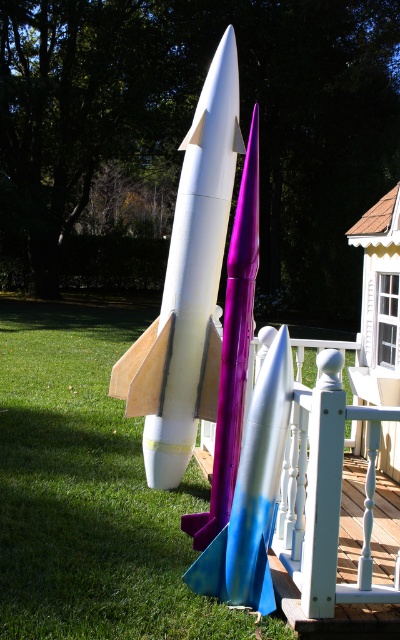
Question: Among these points, which one is nearest to the camera?

Choices:
 (A) (112, 444)
 (B) (216, 547)
 (C) (231, 420)

Answer: (B)

Question: Can you confirm if green grass at center is thinner than purple glossy rocket at center?

Choices:
 (A) yes
 (B) no

Answer: (B)

Question: Does white matte rocket at center appear on the right side of purple glossy rocket at center?

Choices:
 (A) yes
 (B) no

Answer: (B)

Question: Does white matte rocket at center have a lesser width compared to purple glossy rocket at center?

Choices:
 (A) yes
 (B) no

Answer: (B)

Question: Among these points, which one is nearest to the camera?

Choices:
 (A) (181, 300)
 (B) (27, 564)

Answer: (B)

Question: Which point appears closest to the camera in this image?

Choices:
 (A) (84, 589)
 (B) (164, 428)
 (C) (250, 332)

Answer: (A)